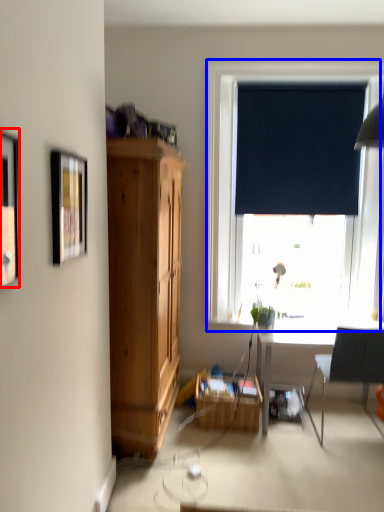
Question: Which point is further to the camera, picture frame (highlighted by a red box) or window (highlighted by a blue box)?

Choices:
 (A) picture frame
 (B) window

Answer: (B)